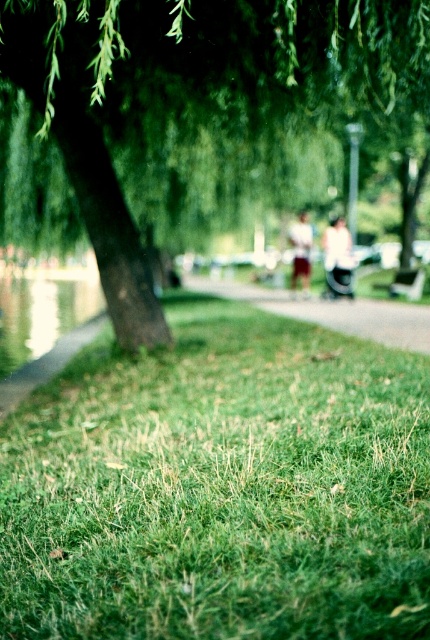
You are a delivery robot navigating a park. You need to move from the smooth asphalt path at center to the clear glass water at lower left. Is the path between them accessible for your wheels?

The smooth asphalt path at center is above clear glass water at lower left, so there is no direct path between them. The robot cannot move from the smooth asphalt path at center to the clear glass water at lower left as they are not connected.

You are standing at the point marked as point (332, 310) in the park. What type of surface are you standing on?

You are standing on smooth asphalt path at center.